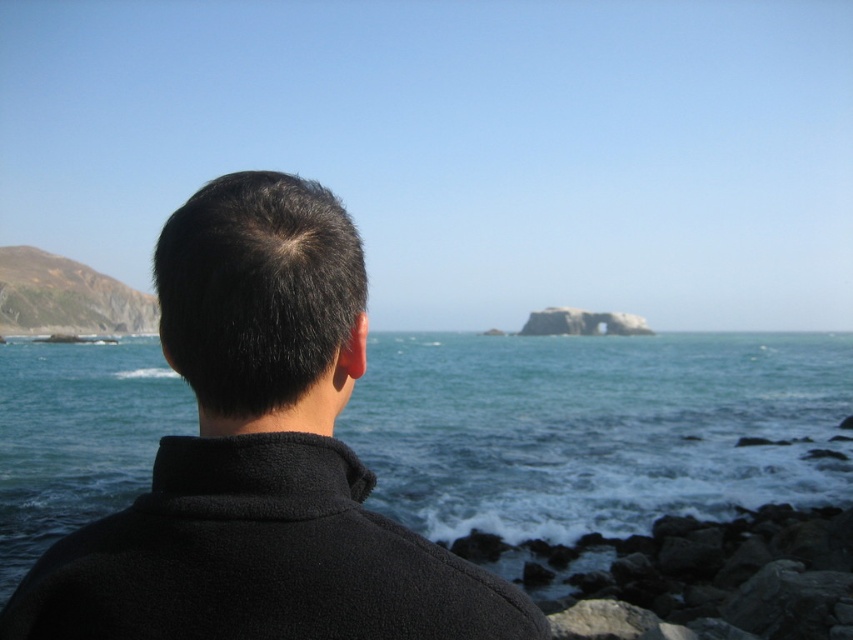
Who is higher up, blue water at center or gray rock at lower right?

Positioned higher is blue water at center.

Does point (532, 524) come in front of point (616, 560)?

No, (532, 524) is behind (616, 560).

Is point (575, 524) farther from viewer compared to point (833, 529)?

Yes, it is behind point (833, 529).

You are a GUI agent. You are given a task and a screenshot of the screen. Output one action in this format:
    pyautogui.click(x=<x>, y=<y>)
    Task: Click on the blue water at center
    The image size is (853, 640).
    Given the screenshot: What is the action you would take?
    pyautogui.click(x=596, y=428)

Who is higher up, black fleece jacket at center or gray rock at lower right?

Positioned higher is black fleece jacket at center.

Which is more to the left, black fleece jacket at center or gray rock at lower right?

black fleece jacket at center is more to the left.

Find the location of `black fleece jacket at center`. black fleece jacket at center is located at coordinates (260, 458).

Find the location of a particular element. The width and height of the screenshot is (853, 640). black fleece jacket at center is located at coordinates (260, 458).

Measure the distance between black fleece jacket at center and green mossy cliff at left.

black fleece jacket at center and green mossy cliff at left are 299.17 meters apart from each other.

Is black fleece jacket at center further to camera compared to green mossy cliff at left?

No.

This screenshot has height=640, width=853. Describe the element at coordinates (260, 458) in the screenshot. I see `black fleece jacket at center` at that location.

Identify the location of black fleece jacket at center. (260, 458).